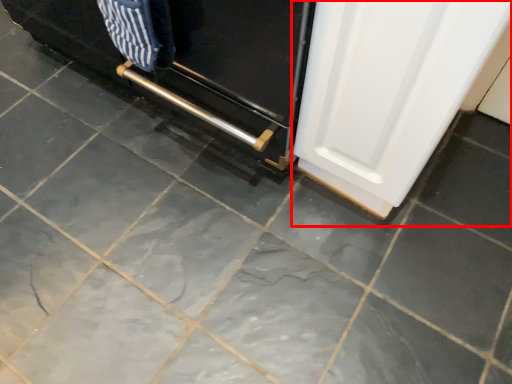
Question: From the image's perspective, what is the correct spatial relationship of door (annotated by the red box) in relation to oven?

Choices:
 (A) above
 (B) below

Answer: (B)